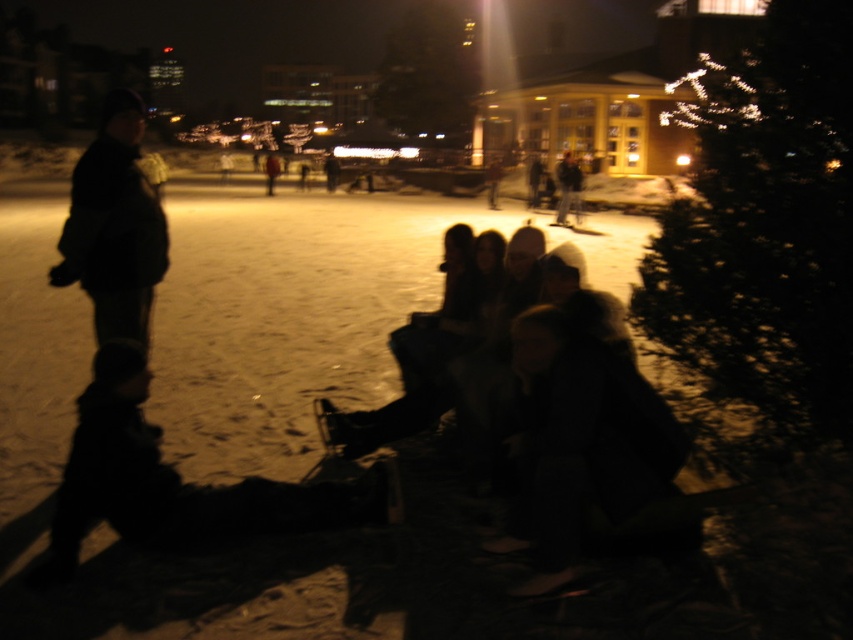
You are planning to deliver a small gift to both the black fabric jacket at left and the dark gray jacket at center. Given that you can only carry the gift for 10 meters before needing to rest, how many rest stops will you need to make between them?

The black fabric jacket at left and dark gray jacket at center are 57.72 feet apart. Converting feet to meters, 57.72 feet is approximately 17.6 meters. Since you can carry the gift for 10 meters before resting, you will need to rest once after the first 10 meters, then again after another 7.6 meters. However, since you can only rest at the halfway point, you need to calculate the number of rest stops required. Wait, actually, the question is a bit ambiguous. The correct approach is to divide the total 17.6

You are organizing a winter event and need to arrange seating for two groups. The first group is wearing the dark fabric jacket at lower left, and the second group is in the dark gray jacket at center. Based on the scene description, which group requires more space for their seating area?

The dark gray jacket at center requires more space for their seating area because it occupies more space than the dark fabric jacket at lower left.

You are a photographer trying to capture a group photo of the people in the scene. You notice the black fabric jacket at left and the dark gray jacket at center. Which jacket should you focus on to ensure the person wearing it is fully visible in the photo?

The black fabric jacket at left is below dark gray jacket at center, so focusing on the dark gray jacket at center would ensure the person wearing it is fully visible as it is not obscured by the lower positioned jacket.